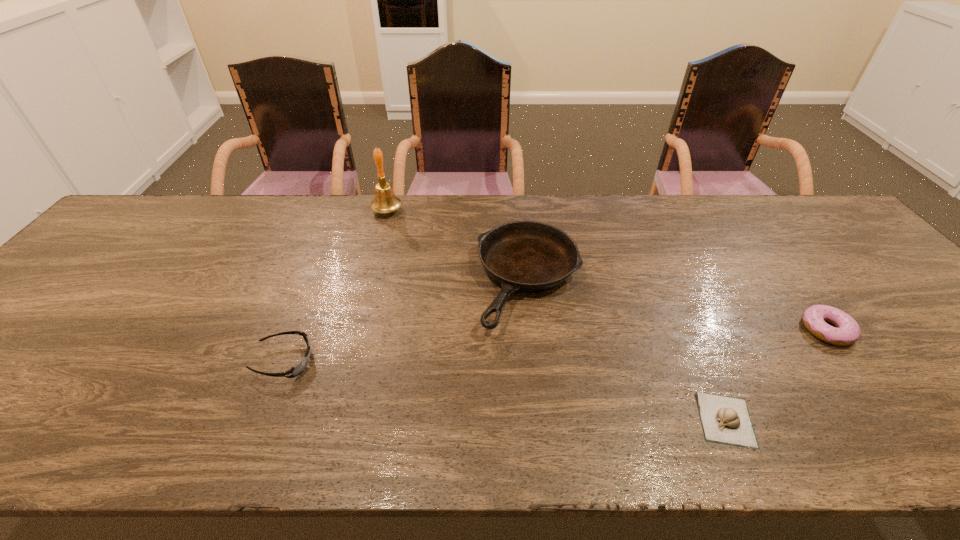
The image size is (960, 540). Identify the location of the second closest object relative to the leftmost object. (385, 201).

Image resolution: width=960 pixels, height=540 pixels. What are the coordinates of `the fourth closest object relative to the sunglasses` in the screenshot? It's located at (815, 317).

Locate an element on the screen. free region that satisfies the following two spatial constraints: 1. on the lenses of the sunglasses; 2. on the right side of the shortest object is located at coordinates (261, 420).

The width and height of the screenshot is (960, 540). Find the location of `free region that satisfies the following two spatial constraints: 1. on the lenses of the leftmost object; 2. on the right side of the nearest object`. free region that satisfies the following two spatial constraints: 1. on the lenses of the leftmost object; 2. on the right side of the nearest object is located at coordinates [261, 420].

At what (x,y) coordinates should I click in order to perform the action: click on vacant area that satisfies the following two spatial constraints: 1. on the lenses of the leftmost object; 2. on the back side of the nearest object. Please return your answer as a coordinate pair (x, y). The width and height of the screenshot is (960, 540). Looking at the image, I should click on (261, 420).

Locate an element on the screen. The height and width of the screenshot is (540, 960). vacant area that satisfies the following two spatial constraints: 1. on the lenses of the sunglasses; 2. on the back side of the shortest object is located at coordinates (261, 420).